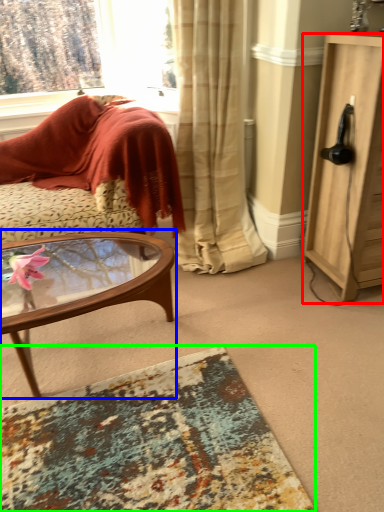
Question: Based on their relative distances, which object is farther from cabinetry (highlighted by a red box)? Choose from coffee table (highlighted by a blue box) and desk (highlighted by a green box).

Choices:
 (A) coffee table
 (B) desk

Answer: (B)